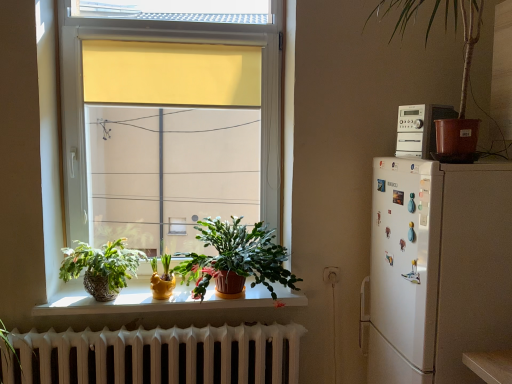
This screenshot has width=512, height=384. Describe the element at coordinates (419, 129) in the screenshot. I see `white matte stereo at upper right` at that location.

Describe the element at coordinates (463, 35) in the screenshot. I see `brown plastic pot at upper right, the fourth houseplant positioned from the bottom` at that location.

Locate an element on the screen. The height and width of the screenshot is (384, 512). textured wicker basket at lower left, marked as the 2th houseplant in a bottom-to-top arrangement is located at coordinates (101, 267).

Is green matte plant at center, marked as the 3th houseplant in a bottom-to-top arrangement, facing away from matte yellow pot at window, the 1th houseplant when ordered from bottom to top?

green matte plant at center, marked as the 3th houseplant in a bottom-to-top arrangement, is not turned away from matte yellow pot at window, the 1th houseplant when ordered from bottom to top.

Considering the sizes of objects green matte plant at center, the third houseplant when ordered from left to right, and matte yellow pot at window, which ranks as the 2th houseplant in left-to-right order, in the image provided, who is wider, green matte plant at center, the third houseplant when ordered from left to right, or matte yellow pot at window, which ranks as the 2th houseplant in left-to-right order,?

With larger width is green matte plant at center, the third houseplant when ordered from left to right.

From a real-world perspective, is green matte plant at center, the third houseplant when ordered from left to right, physically located above or below matte yellow pot at window, the 1th houseplant when ordered from bottom to top?

green matte plant at center, the third houseplant when ordered from left to right, is above matte yellow pot at window, the 1th houseplant when ordered from bottom to top.

From the image's perspective, does matte yellow pot at window, which ranks as the 2th houseplant in left-to-right order, appear lower than green matte plant at center, the third houseplant when ordered from left to right?

Yes, from the image's perspective, matte yellow pot at window, which ranks as the 2th houseplant in left-to-right order, is below green matte plant at center, the third houseplant when ordered from left to right.

Do you think matte yellow pot at window, the 1th houseplant when ordered from bottom to top, is within green matte plant at center, marked as the 3th houseplant in a bottom-to-top arrangement, or outside of it?

matte yellow pot at window, the 1th houseplant when ordered from bottom to top, is outside green matte plant at center, marked as the 3th houseplant in a bottom-to-top arrangement.

From a real-world perspective, between matte yellow pot at window, the third houseplant positioned from the right, and white matte stereo at upper right, who is vertically lower?

matte yellow pot at window, the third houseplant positioned from the right, is physically lower.

How different are the orientations of matte yellow pot at window, the third houseplant positioned from the right, and white matte stereo at upper right in degrees?

They differ by 65.1 degrees in their facing directions.

Who is smaller, matte yellow pot at window, the 1th houseplant when ordered from bottom to top, or white matte stereo at upper right?

matte yellow pot at window, the 1th houseplant when ordered from bottom to top.

From the image's perspective, is matte yellow pot at window, which ranks as the 2th houseplant in left-to-right order, under white matte stereo at upper right?

Yes, from the image's perspective, matte yellow pot at window, which ranks as the 2th houseplant in left-to-right order, is beneath white matte stereo at upper right.

Can you confirm if matte yellow pot at window, the third houseplant positioned from the right, is smaller than brown plastic pot at upper right, acting as the first houseplant starting from the top?

Correct, matte yellow pot at window, the third houseplant positioned from the right, occupies less space than brown plastic pot at upper right, acting as the first houseplant starting from the top.

Is matte yellow pot at window, the third houseplant positioned from the right, aimed at brown plastic pot at upper right, arranged as the 1th houseplant when viewed from the right?

No, matte yellow pot at window, the third houseplant positioned from the right, does not turn towards brown plastic pot at upper right, arranged as the 1th houseplant when viewed from the right.

Is point (168, 262) closer to camera compared to point (476, 19)?

No, (168, 262) is behind (476, 19).

Does white matte stereo at upper right have a lesser height compared to textured wicker basket at lower left, arranged as the fourth houseplant when viewed from the right?

Indeed, white matte stereo at upper right has a lesser height compared to textured wicker basket at lower left, arranged as the fourth houseplant when viewed from the right.

Is white matte stereo at upper right positioned far away from textured wicker basket at lower left, arranged as the 3th houseplant when viewed from the top?

That's right, there is a large distance between white matte stereo at upper right and textured wicker basket at lower left, arranged as the 3th houseplant when viewed from the top.

From the image's perspective, which is above, white matte stereo at upper right or textured wicker basket at lower left, arranged as the 3th houseplant when viewed from the top?

white matte stereo at upper right.

Does white matte stereo at upper right have a lesser width compared to textured wicker basket at lower left, arranged as the 3th houseplant when viewed from the top?

Yes, white matte stereo at upper right is thinner than textured wicker basket at lower left, arranged as the 3th houseplant when viewed from the top.

Based on the photo, can you confirm if white matte stereo at upper right is thinner than green matte plant at center, the second houseplant when ordered from right to left?

Indeed, white matte stereo at upper right has a lesser width compared to green matte plant at center, the second houseplant when ordered from right to left.

Is green matte plant at center, the 2th houseplant viewed from the top, at the back of white matte stereo at upper right?

No, white matte stereo at upper right is not facing the opposite direction of green matte plant at center, the 2th houseplant viewed from the top.

Does white matte stereo at upper right appear on the right side of green matte plant at center, the second houseplant when ordered from right to left?

Indeed, white matte stereo at upper right is positioned on the right side of green matte plant at center, the second houseplant when ordered from right to left.

Is white matte stereo at upper right inside or outside of green matte plant at center, the second houseplant when ordered from right to left?

white matte stereo at upper right cannot be found inside green matte plant at center, the second houseplant when ordered from right to left.

From a real-world perspective, relative to matte yellow pot at window, which ranks as the 2th houseplant in left-to-right order, is brown plastic pot at upper right, arranged as the 1th houseplant when viewed from the right, vertically above or below?

brown plastic pot at upper right, arranged as the 1th houseplant when viewed from the right, is above matte yellow pot at window, which ranks as the 2th houseplant in left-to-right order.

At what (x,y) coordinates should I click in order to perform the action: click on the 2nd houseplant counting from the left of the brown plastic pot at upper right, acting as the first houseplant starting from the top. Please return your answer as a coordinate pair (x, y). Image resolution: width=512 pixels, height=384 pixels. Looking at the image, I should click on (162, 279).

Looking at their sizes, would you say brown plastic pot at upper right, the fourth houseplant positioned from the bottom, is wider or thinner than matte yellow pot at window, the 1th houseplant when ordered from bottom to top?

Clearly, brown plastic pot at upper right, the fourth houseplant positioned from the bottom, has more width compared to matte yellow pot at window, the 1th houseplant when ordered from bottom to top.

At what (x,y) coordinates should I click in order to perform the action: click on houseplant that is the 2nd one when counting forward from the matte yellow pot at window, the 1th houseplant when ordered from bottom to top. Please return your answer as a coordinate pair (x, y). Looking at the image, I should click on (236, 260).

The width and height of the screenshot is (512, 384). What are the coordinates of `houseplant that is the 1st object to the right of the matte yellow pot at window, the 1th houseplant when ordered from bottom to top, starting at the anchor` in the screenshot? It's located at coord(236,260).

When comparing their distances from matte yellow pot at window, which ranks as the 2th houseplant in left-to-right order, does textured wicker basket at lower left, arranged as the fourth houseplant when viewed from the right, or brown plastic pot at upper right, the fourth houseplant positioned from the bottom, seem closer?

textured wicker basket at lower left, arranged as the fourth houseplant when viewed from the right, lies closer to matte yellow pot at window, which ranks as the 2th houseplant in left-to-right order, than the other object.

Looking at the image, which one is located further to white matte stereo at upper right, matte yellow pot at window, which ranks as the 2th houseplant in left-to-right order, or textured wicker basket at lower left, arranged as the first houseplant when viewed from the left?

The object further to white matte stereo at upper right is textured wicker basket at lower left, arranged as the first houseplant when viewed from the left.

Considering their positions, is textured wicker basket at lower left, arranged as the 3th houseplant when viewed from the top, positioned further to brown plastic pot at upper right, arranged as the 1th houseplant when viewed from the right, than matte yellow pot at window, the third houseplant positioned from the right?

textured wicker basket at lower left, arranged as the 3th houseplant when viewed from the top, lies further to brown plastic pot at upper right, arranged as the 1th houseplant when viewed from the right, than the other object.

Looking at the image, which one is located closer to matte yellow pot at window, the 1th houseplant when ordered from bottom to top, green matte plant at center, marked as the 3th houseplant in a bottom-to-top arrangement, or white matte stereo at upper right?

green matte plant at center, marked as the 3th houseplant in a bottom-to-top arrangement, is closer to matte yellow pot at window, the 1th houseplant when ordered from bottom to top.

Estimate the real-world distances between objects in this image. Which object is further from matte yellow pot at window, the 1th houseplant when ordered from bottom to top, white matte stereo at upper right or green matte plant at center, the third houseplant when ordered from left to right?

white matte stereo at upper right.

Estimate the real-world distances between objects in this image. Which object is further from green matte plant at center, the second houseplant when ordered from right to left, matte yellow pot at window, the 1th houseplant when ordered from bottom to top, or textured wicker basket at lower left, arranged as the 3th houseplant when viewed from the top?

The object further to green matte plant at center, the second houseplant when ordered from right to left, is textured wicker basket at lower left, arranged as the 3th houseplant when viewed from the top.

From the image, which object appears to be nearer to textured wicker basket at lower left, marked as the 2th houseplant in a bottom-to-top arrangement, brown plastic pot at upper right, arranged as the 1th houseplant when viewed from the right, or white matte stereo at upper right?

white matte stereo at upper right.

From the image, which object appears to be nearer to white matte stereo at upper right, brown plastic pot at upper right, which ranks as the fourth houseplant in left-to-right order, or textured wicker basket at lower left, arranged as the first houseplant when viewed from the left?

The object closer to white matte stereo at upper right is brown plastic pot at upper right, which ranks as the fourth houseplant in left-to-right order.

What are the coordinates of `houseplant between textured wicker basket at lower left, arranged as the first houseplant when viewed from the left, and green matte plant at center, the second houseplant when ordered from right to left, from left to right` in the screenshot? It's located at pos(162,279).

The width and height of the screenshot is (512, 384). In order to click on houseplant located between green matte plant at center, the second houseplant when ordered from right to left, and white matte stereo at upper right in the left-right direction in this screenshot , I will do click(463, 35).

At what (x,y) coordinates should I click in order to perform the action: click on houseplant located between matte yellow pot at window, which ranks as the 2th houseplant in left-to-right order, and brown plastic pot at upper right, acting as the first houseplant starting from the top, in the left-right direction. Please return your answer as a coordinate pair (x, y). Looking at the image, I should click on (236, 260).